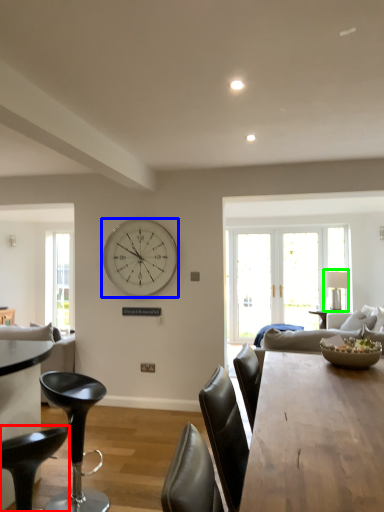
Question: Which object is the farthest from chair (highlighted by a red box)? Choose among these: wall clock (highlighted by a blue box) or lamp (highlighted by a green box).

Choices:
 (A) wall clock
 (B) lamp

Answer: (B)